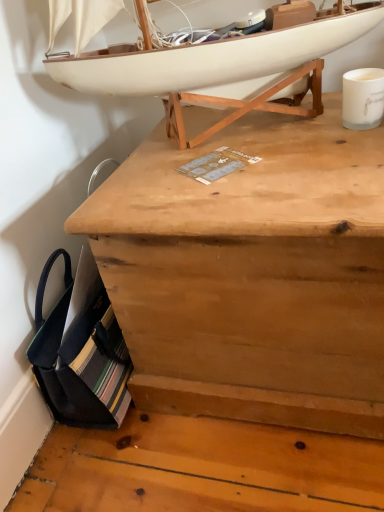
Question: In the image, is white matte coffee cup at upper right positioned in front of or behind natural wood chest at center?

Choices:
 (A) front
 (B) behind

Answer: (B)

Question: From the image's perspective, is white matte coffee cup at upper right positioned above or below natural wood chest at center?

Choices:
 (A) below
 (B) above

Answer: (B)

Question: Estimate the real-world distances between objects in this image. Which object is farther from the white matte coffee cup at upper right?

Choices:
 (A) white matte boat at upper center
 (B) natural wood chest at center

Answer: (B)

Question: Which of these objects is positioned farthest from the natural wood chest at center?

Choices:
 (A) white matte coffee cup at upper right
 (B) white matte boat at upper center

Answer: (A)